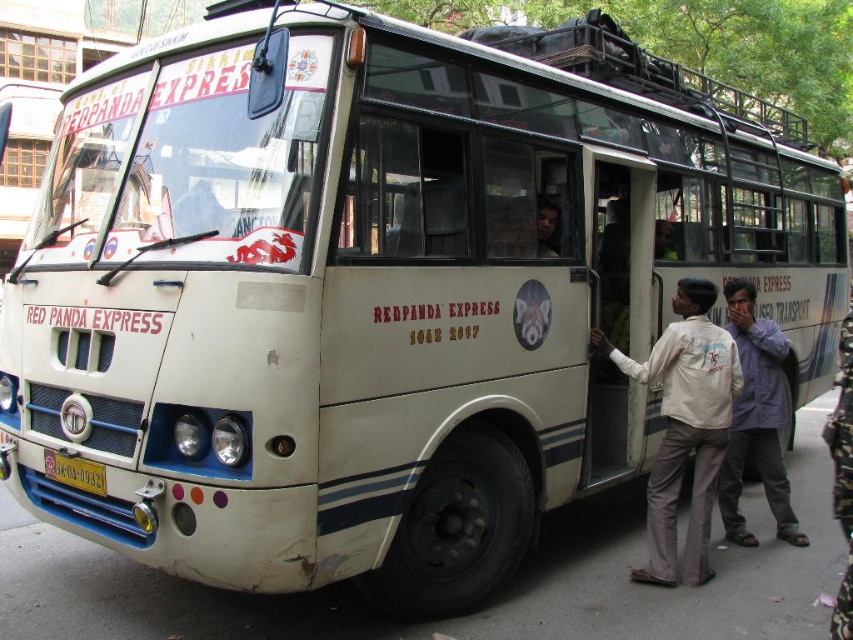
Question: Which of these objects is positioned farthest from the yellow matte license plate at lower center?

Choices:
 (A) light purple shirt at center
 (B) white cotton shirt at right

Answer: (A)

Question: From the image, what is the correct spatial relationship of white cotton shirt at right in relation to light purple shirt at center?

Choices:
 (A) right
 (B) left

Answer: (B)

Question: Is light purple shirt at center thinner than yellow matte license plate at lower center?

Choices:
 (A) yes
 (B) no

Answer: (B)

Question: Which of these objects is positioned closest to the light purple shirt at center?

Choices:
 (A) yellow matte license plate at lower center
 (B) white cotton shirt at right

Answer: (B)

Question: Does light purple shirt at center have a smaller size compared to yellow matte license plate at lower center?

Choices:
 (A) yes
 (B) no

Answer: (B)

Question: Which point is closer to the camera?

Choices:
 (A) (772, 445)
 (B) (96, 476)
 (C) (679, 403)

Answer: (B)